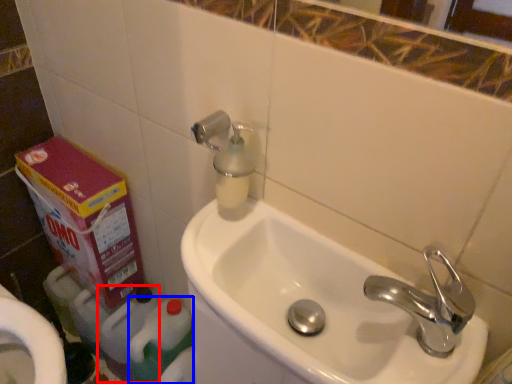
Question: Which of the following is the farthest to the observer, cleaning product (highlighted by a red box) or cleaning product (highlighted by a blue box)?

Choices:
 (A) cleaning product
 (B) cleaning product

Answer: (A)